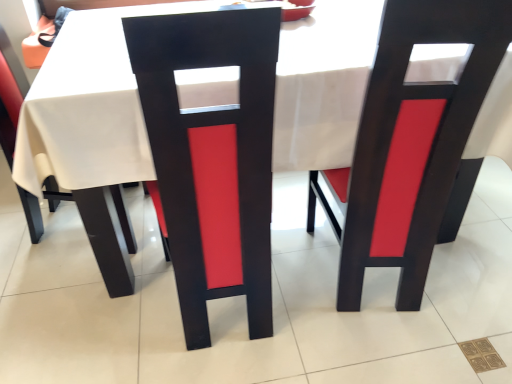
Question: In the image, is matte black chair at left, the third chair viewed from the right, positioned in front of or behind matte black chair at center, positioned as the 2th chair in left-to-right order?

Choices:
 (A) front
 (B) behind

Answer: (B)

Question: Considering the positions of matte black chair at left, the third chair viewed from the right, and matte black chair at center, positioned as the 2th chair in left-to-right order, in the image, is matte black chair at left, the third chair viewed from the right, taller or shorter than matte black chair at center, positioned as the 2th chair in left-to-right order,?

Choices:
 (A) short
 (B) tall

Answer: (A)

Question: Which of these objects is positioned farthest from the matte black chair at left, the third chair viewed from the right?

Choices:
 (A) matte black chair at center, which is the 1th chair in right-to-left order
 (B) matte black chair at center, acting as the second chair starting from the right

Answer: (A)

Question: Based on their relative distances, which object is farther from the matte black chair at center, which is the 1th chair in right-to-left order?

Choices:
 (A) matte black chair at left, placed as the 1th chair when sorted from left to right
 (B) matte black chair at center, positioned as the 2th chair in left-to-right order

Answer: (A)